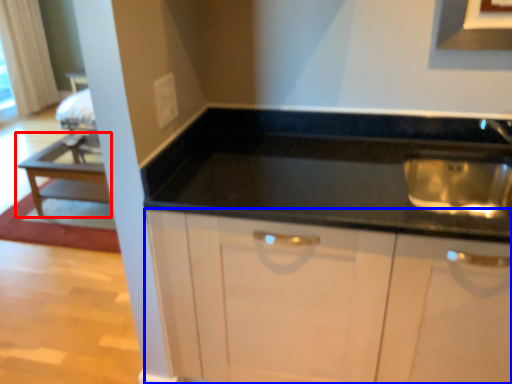
Question: Among these objects, which one is nearest to the camera, table (highlighted by a red box) or cabinetry (highlighted by a blue box)?

Choices:
 (A) table
 (B) cabinetry

Answer: (B)